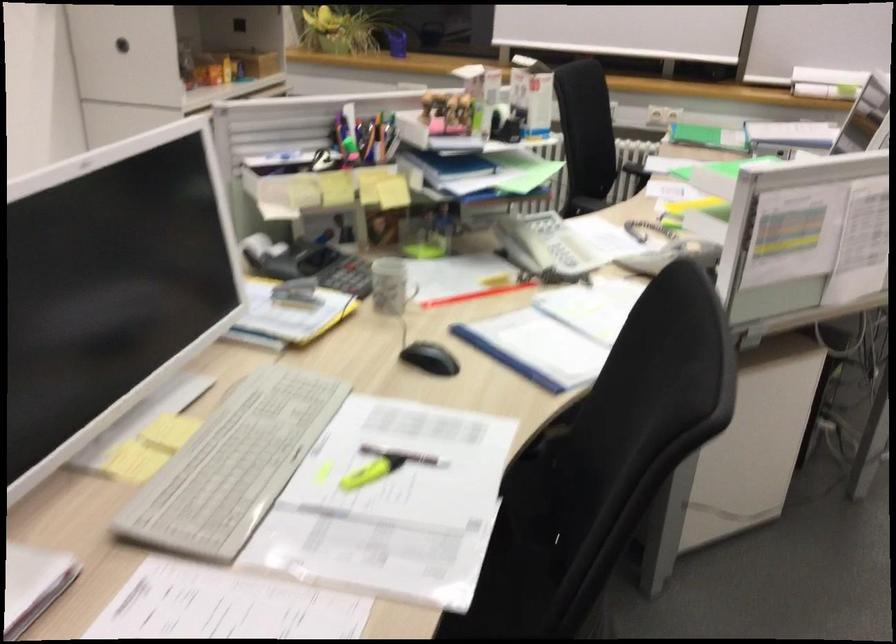
Which object does [348,276] point to?

This point indicates the black calculator.